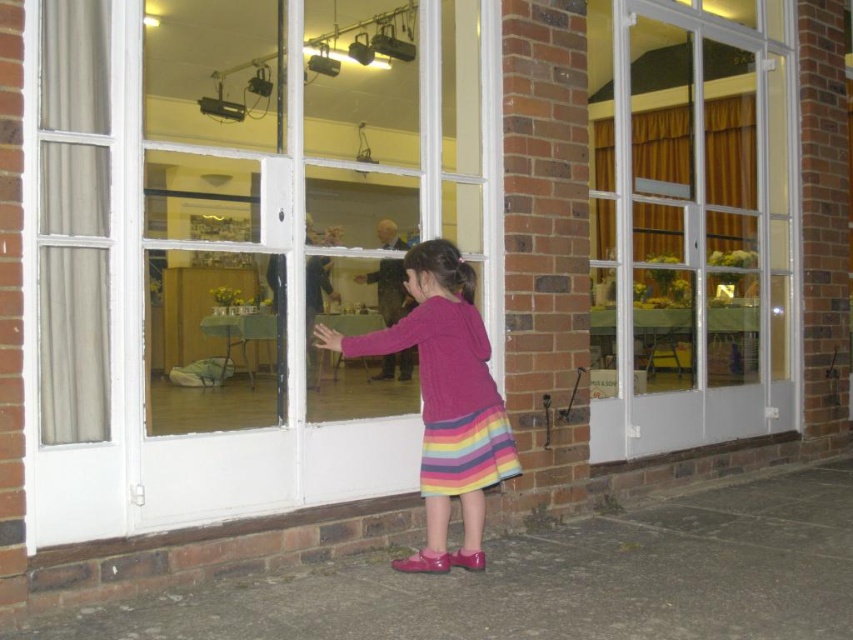
The girl is trying to reach something. Based on the scene, which object is closer to her hand? The clear glass door at center or the knitted pink sweater at center?

The knitted pink sweater at center is closer to her hand because the clear glass door at center is positioned over it, meaning the sweater is beneath the door.

You are a delivery person carrying a box that is 2 meters long. You need to pass through the clear glass door at center while avoiding the knitted pink sweater at center. Is the space between them wide enough for your box?

The clear glass door at center and knitted pink sweater at center are 2.10 meters apart, so the space between them is wide enough to fit a 2 meter long box.

You are a delivery person holding a box that is 3 meters long. You need to bring the box into the building through the transparent glass door at center. Can you fit the box through the door without tilting it? Please explain your reasoning.

The transparent glass door at center is 2.87 meters from camera. Since the box is 3 meters long, which is longer than the distance available, the box cannot be fit through the door without tilting it.